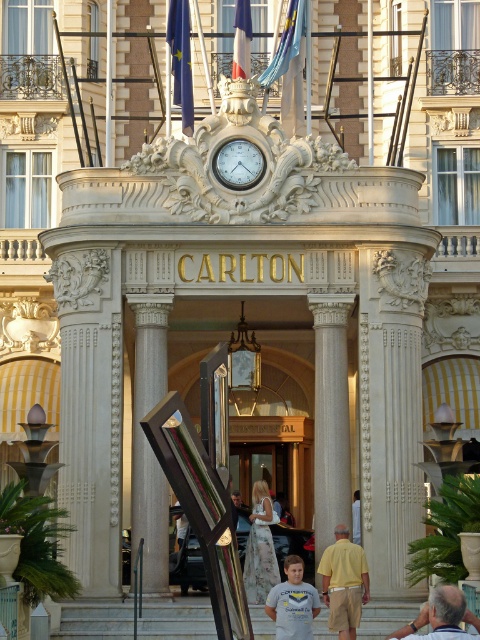
Question: Does yellow cotton shirt at center lie in front of gold metallic clock at center?

Choices:
 (A) yes
 (B) no

Answer: (A)

Question: Which object is positioned farthest from the gold metallic clock at center?

Choices:
 (A) white marble column at center
 (B) gray cotton t-shirt at center
 (C) floral dress at center
 (D) light brown leather chair at lower right

Answer: (D)

Question: Does yellow cotton shirt at center appear under gold metallic clock at center?

Choices:
 (A) no
 (B) yes

Answer: (B)

Question: Can you confirm if white marble pillar at center is positioned above gray cotton t-shirt at center?

Choices:
 (A) yes
 (B) no

Answer: (A)

Question: Which of the following is the closest to the observer?

Choices:
 (A) (255, 586)
 (B) (149, 460)
 (C) (455, 624)
 (D) (325, 516)

Answer: (C)

Question: Considering the real-world distances, which object is farthest from the white marble pillar at center?

Choices:
 (A) gold metallic clock at center
 (B) white marble column at center

Answer: (A)